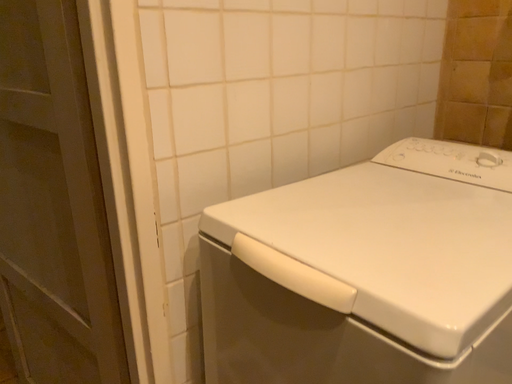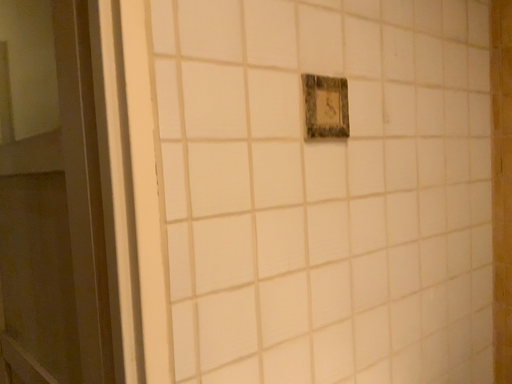
Question: Which way did the camera rotate in the video?

Choices:
 (A) rotated downward
 (B) rotated upward

Answer: (B)